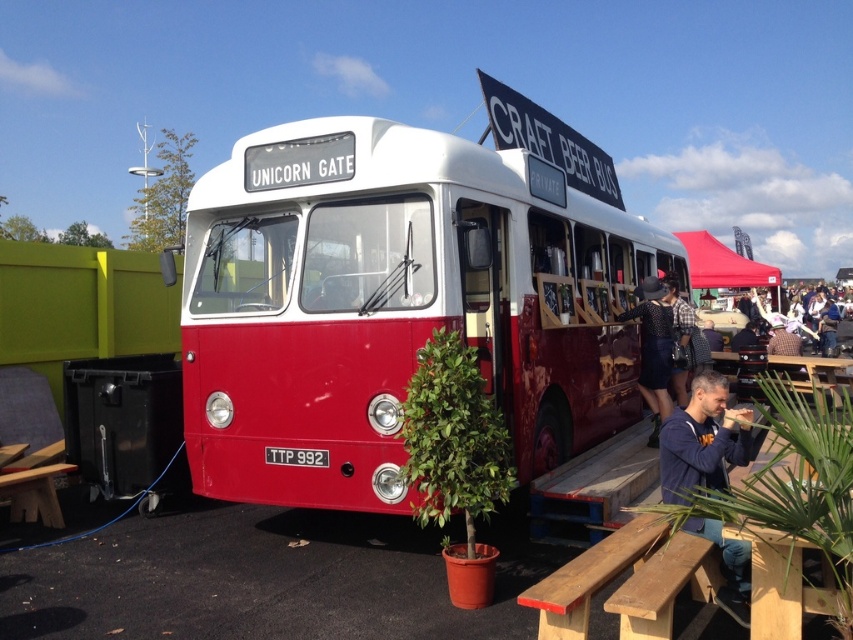
Between matte red bus at center and blue cotton shirt at lower right, which one is positioned lower?

blue cotton shirt at lower right is lower down.

Does matte red bus at center have a lesser height compared to blue cotton shirt at lower right?

In fact, matte red bus at center may be taller than blue cotton shirt at lower right.

You are a GUI agent. You are given a task and a screenshot of the screen. Output one action in this format:
    pyautogui.click(x=<x>, y=<y>)
    Task: Click on the matte red bus at center
    Image resolution: width=853 pixels, height=640 pixels.
    Given the screenshot: What is the action you would take?
    pyautogui.click(x=395, y=305)

Find the location of a particular element. This screenshot has width=853, height=640. matte red bus at center is located at coordinates (395, 305).

Where is `matte red bus at center`? matte red bus at center is located at coordinates (395, 305).

Does matte red bus at center have a larger size compared to black dotted dress at center?

Yes, matte red bus at center is bigger than black dotted dress at center.

Does point (422, 236) come farther from viewer compared to point (654, 413)?

No, it is not.

Identify the location of matte red bus at center. The height and width of the screenshot is (640, 853). (395, 305).

Does blue cotton shirt at lower right appear on the left side of polka dot dress at center?

Correct, you'll find blue cotton shirt at lower right to the left of polka dot dress at center.

Is blue cotton shirt at lower right taller than polka dot dress at center?

No, blue cotton shirt at lower right is not taller than polka dot dress at center.

Does point (677, 502) come behind point (683, 337)?

That is False.

Where is `blue cotton shirt at lower right`? blue cotton shirt at lower right is located at coordinates (701, 440).